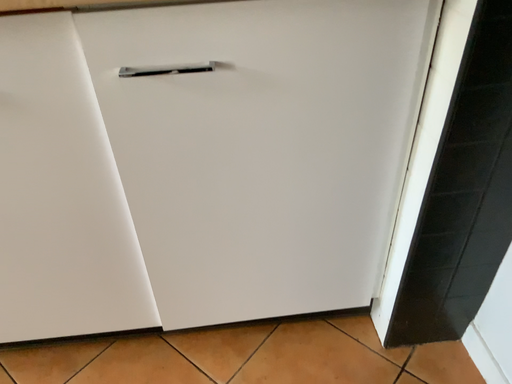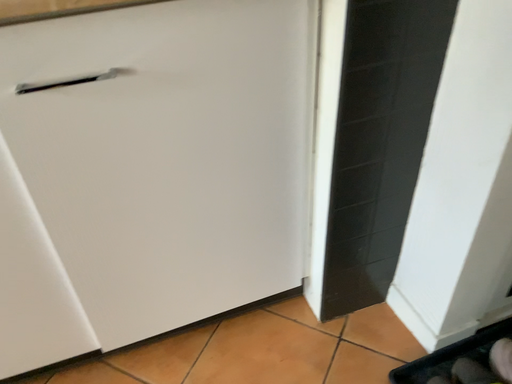
Question: How did the camera likely rotate when shooting the video?

Choices:
 (A) rotated right
 (B) rotated left

Answer: (A)